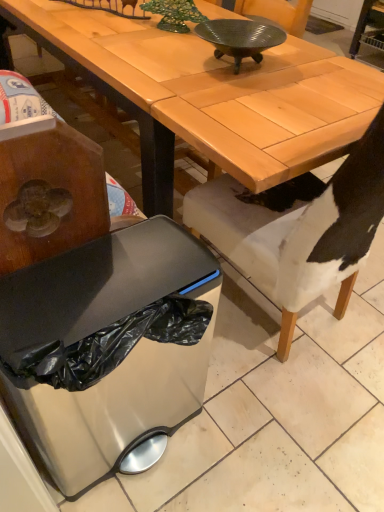
Image resolution: width=384 pixels, height=512 pixels. What do you see at coordinates (298, 231) in the screenshot?
I see `white fabric chair at lower right` at bounding box center [298, 231].

Where is `metallic ribbed bowl at center`? The height and width of the screenshot is (512, 384). metallic ribbed bowl at center is located at coordinates (240, 38).

Is point (217, 26) behind point (316, 53)?

No, (217, 26) is in front of (316, 53).

Is metallic ribbed bowl at center taller than matte wood desk at center?

No.

Visually, is metallic ribbed bowl at center positioned to the left or to the right of matte wood desk at center?

From the image, it's evident that metallic ribbed bowl at center is to the right of matte wood desk at center.

Looking at the image, does metallic ribbed bowl at center seem bigger or smaller compared to matte wood desk at center?

In the image, metallic ribbed bowl at center appears to be smaller than matte wood desk at center.

From a real-world perspective, is white fabric chair at lower right above or below satin silver trash can at lower left?

Clearly, from a real-world perspective, white fabric chair at lower right is above satin silver trash can at lower left.

Does white fabric chair at lower right appear on the right side of satin silver trash can at lower left?

Yes.

From the image's perspective, which object appears higher, white fabric chair at lower right or satin silver trash can at lower left?

From the image's view, white fabric chair at lower right is above.

Can you confirm if white fabric chair at lower right is wider than satin silver trash can at lower left?

Yes.

How many degrees apart are the facing directions of satin silver trash can at lower left and white fabric chair at lower right?

The angular difference between satin silver trash can at lower left and white fabric chair at lower right is 180 degrees.

Does point (207, 321) lie in front of point (335, 177)?

Yes, it is.

Looking at their sizes, would you say satin silver trash can at lower left is wider or thinner than white fabric chair at lower right?

Considering their sizes, satin silver trash can at lower left looks slimmer than white fabric chair at lower right.

Is satin silver trash can at lower left not within white fabric chair at lower right?

Absolutely, satin silver trash can at lower left is external to white fabric chair at lower right.

How much distance is there between satin silver trash can at lower left and metallic ribbed bowl at center?

The distance of satin silver trash can at lower left from metallic ribbed bowl at center is 98.48 centimeters.

The height and width of the screenshot is (512, 384). Find the location of `bowl above the satin silver trash can at lower left (from the image's perspective)`. bowl above the satin silver trash can at lower left (from the image's perspective) is located at coordinates pyautogui.click(x=240, y=38).

Between satin silver trash can at lower left and metallic ribbed bowl at center, which one has smaller size?

With smaller size is metallic ribbed bowl at center.

In the scene shown: From the image's perspective, which is below, satin silver trash can at lower left or metallic ribbed bowl at center?

From the image's view, satin silver trash can at lower left is below.

How distant is satin silver trash can at lower left from matte wood desk at center?

The distance of satin silver trash can at lower left from matte wood desk at center is 24.85 inches.

Is matte wood desk at center inside satin silver trash can at lower left?

No, matte wood desk at center is not inside satin silver trash can at lower left.

In terms of width, does satin silver trash can at lower left look wider or thinner when compared to matte wood desk at center?

satin silver trash can at lower left is thinner than matte wood desk at center.

Is satin silver trash can at lower left bigger than matte wood desk at center?

Actually, satin silver trash can at lower left might be smaller than matte wood desk at center.

From a real-world perspective, is white fabric chair at lower right located beneath metallic ribbed bowl at center?

Yes.

How many degrees apart are the facing directions of white fabric chair at lower right and metallic ribbed bowl at center?

87.6 degrees.

Is point (293, 265) behind point (243, 52)?

No, (293, 265) is closer to viewer.

In the scene shown: Is white fabric chair at lower right directly adjacent to metallic ribbed bowl at center?

No, white fabric chair at lower right is not beside metallic ribbed bowl at center.

Is satin silver trash can at lower left inside metallic ribbed bowl at center?

No.

Based on their sizes in the image, would you say metallic ribbed bowl at center is bigger or smaller than satin silver trash can at lower left?

In the image, metallic ribbed bowl at center appears to be smaller than satin silver trash can at lower left.

From the image's perspective, which object appears higher, metallic ribbed bowl at center or satin silver trash can at lower left?

From the image's view, metallic ribbed bowl at center is above.

Based on the photo, which point is more forward, (238, 45) or (127, 380)?

The point (127, 380) is in front.

The width and height of the screenshot is (384, 512). There is a matte wood desk at center. Find the location of `bowl above it (from a real-world perspective)`. bowl above it (from a real-world perspective) is located at coordinates (240, 38).

Identify the location of chair that appears on the right of satin silver trash can at lower left. (298, 231).

Considering their positions, is white fabric chair at lower right positioned further to matte wood desk at center than satin silver trash can at lower left?

Based on the image, satin silver trash can at lower left appears to be further to matte wood desk at center.

Based on their spatial positions, is satin silver trash can at lower left or matte wood desk at center further from metallic ribbed bowl at center?

Based on the image, satin silver trash can at lower left appears to be further to metallic ribbed bowl at center.

Considering their positions, is satin silver trash can at lower left positioned further to matte wood desk at center than metallic ribbed bowl at center?

satin silver trash can at lower left is positioned further to the anchor matte wood desk at center.

Considering their positions, is white fabric chair at lower right positioned further to satin silver trash can at lower left than matte wood desk at center?

Based on the image, matte wood desk at center appears to be further to satin silver trash can at lower left.

Estimate the real-world distances between objects in this image. Which object is closer to metallic ribbed bowl at center, matte wood desk at center or satin silver trash can at lower left?

matte wood desk at center is positioned closer to the anchor metallic ribbed bowl at center.

Based on their spatial positions, is white fabric chair at lower right or matte wood desk at center further from metallic ribbed bowl at center?

white fabric chair at lower right is positioned further to the anchor metallic ribbed bowl at center.

When comparing their distances from satin silver trash can at lower left, does matte wood desk at center or metallic ribbed bowl at center seem further?

The object further to satin silver trash can at lower left is metallic ribbed bowl at center.

Looking at the image, which one is located closer to metallic ribbed bowl at center, matte wood desk at center or white fabric chair at lower right?

Among the two, matte wood desk at center is located nearer to metallic ribbed bowl at center.

Locate an element on the screen. bowl between matte wood desk at center and satin silver trash can at lower left from top to bottom is located at coordinates (240, 38).

Where is `chair between matte wood desk at center and satin silver trash can at lower left from top to bottom`? chair between matte wood desk at center and satin silver trash can at lower left from top to bottom is located at coordinates (298, 231).

This screenshot has height=512, width=384. I want to click on bowl located between matte wood desk at center and white fabric chair at lower right in the left-right direction, so pos(240,38).

Image resolution: width=384 pixels, height=512 pixels. I want to click on chair between metallic ribbed bowl at center and satin silver trash can at lower left vertically, so click(298, 231).